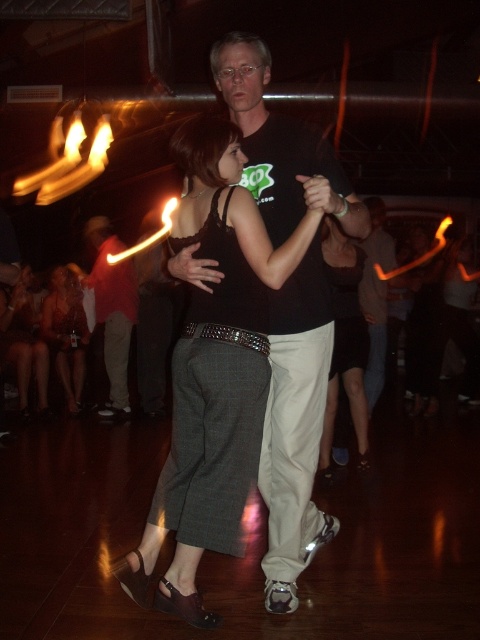
Question: Which of the following is the farthest from the observer?

Choices:
 (A) matte black pants at center
 (B) brown leather purse at lower left
 (C) matte black shirt at center

Answer: (B)

Question: Can you confirm if black leather pants at center is smaller than matte black pants at center?

Choices:
 (A) no
 (B) yes

Answer: (B)

Question: Which point is closer to the camera?

Choices:
 (A) (360, 362)
 (B) (269, 61)
 (C) (126, 300)

Answer: (B)

Question: Is dark gray textured pants at center in front of matte black shirt at center?

Choices:
 (A) no
 (B) yes

Answer: (B)

Question: Does dark gray textured pants at center have a lesser width compared to black cotton shirt at center?

Choices:
 (A) yes
 (B) no

Answer: (B)

Question: Among these points, which one is farthest from the camera?

Choices:
 (A) (372, 326)
 (B) (83, 321)
 (C) (87, 285)
 (D) (335, 268)

Answer: (C)